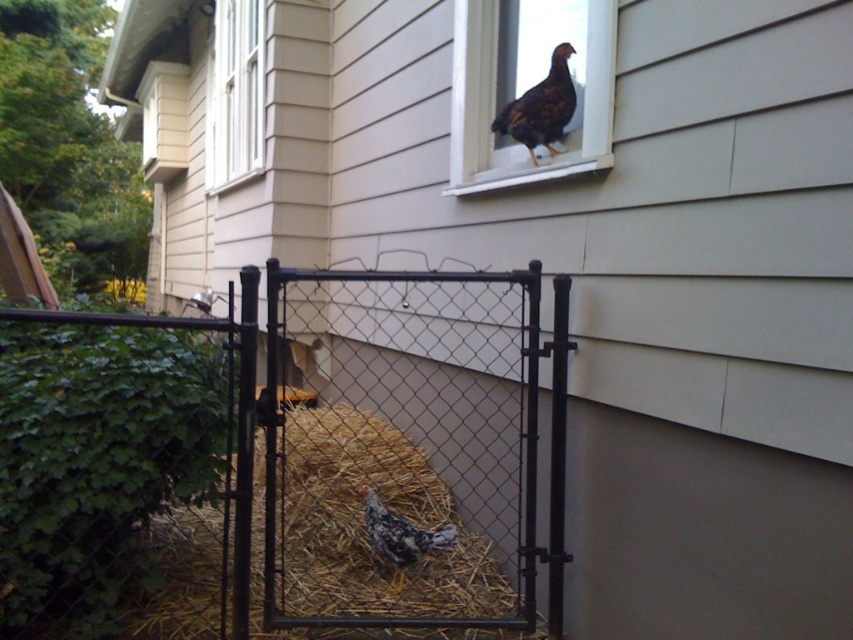
Question: Is straw bedding at center bigger than speckled feathered chicken at lower center?

Choices:
 (A) no
 (B) yes

Answer: (B)

Question: Among these points, which one is farthest from the camera?

Choices:
 (A) (229, 48)
 (B) (339, 451)
 (C) (598, 72)
 (D) (532, 144)

Answer: (A)

Question: Does black chain-link fence at center have a greater width compared to matte glass window at upper center?

Choices:
 (A) yes
 (B) no

Answer: (A)

Question: Which object is closer to the camera taking this photo?

Choices:
 (A) black chain-link fence at center
 (B) speckled feathered chicken at lower center
 (C) white painted wood window at upper left
 (D) dark brown speckled chicken at upper center

Answer: (A)

Question: Which object appears closest to the camera in this image?

Choices:
 (A) matte glass window at upper center
 (B) dark brown speckled chicken at upper center
 (C) straw bedding at center

Answer: (A)

Question: Is straw bedding at center bigger than dark brown speckled chicken at upper center?

Choices:
 (A) yes
 (B) no

Answer: (A)